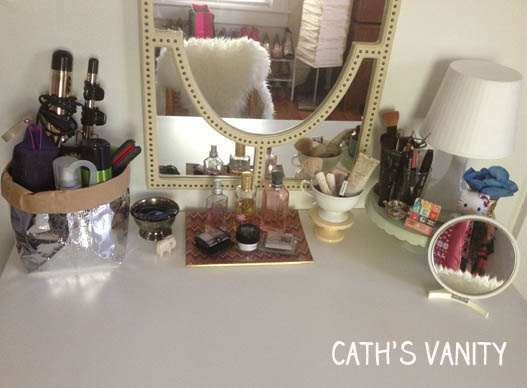
Identify the location of dresser. The image size is (527, 388). (232, 343).